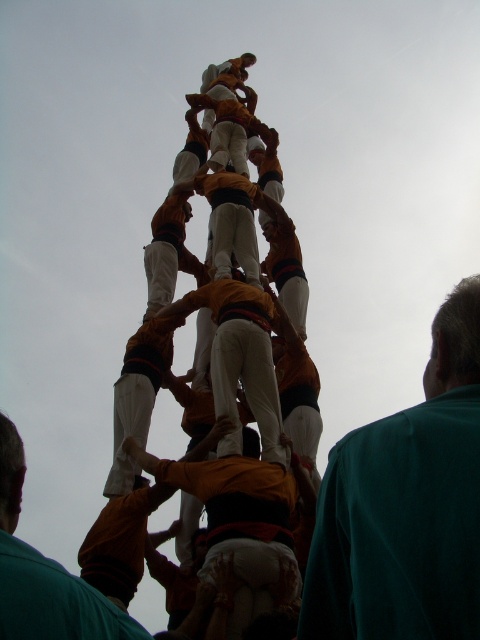
You are a photographer standing at the base of the human tower and want to capture a closeup shot of the orange fabric man at center. Given that your camera can focus on subjects within 70 meters, will you be able to take the photo without moving closer?

The orange fabric man at center is 73.63 meters from the viewer. Since the camera can focus up to 70 meters, the distance is beyond the camera s focusing range. Moving closer would be necessary to capture the closeup.

You are a photographer standing at the base of the human tower. You want to capture a photo that includes both the green fabric shirt at lower right and the orange fabric man at center. Which one will appear larger in your photo?

The green fabric shirt at lower right will appear larger in the photo because it is closer to the viewer than the orange fabric man at center.